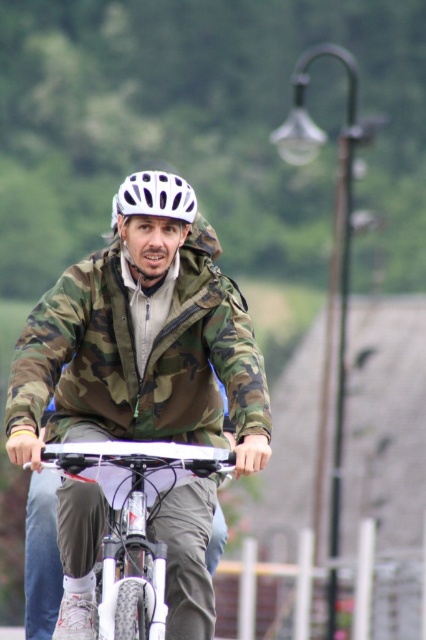
Question: Which object is positioned farthest from the camo fabric jacket at center?

Choices:
 (A) white matte bicycle at center
 (B) white matte helmet at center

Answer: (B)

Question: Observing the image, what is the correct spatial positioning of camo fabric jacket at center in reference to white matte bicycle at center?

Choices:
 (A) below
 (B) above

Answer: (B)

Question: Does camo fabric jacket at center have a smaller size compared to white matte helmet at center?

Choices:
 (A) yes
 (B) no

Answer: (A)

Question: Is camo fabric jacket at center bigger than white matte helmet at center?

Choices:
 (A) yes
 (B) no

Answer: (B)

Question: Considering the real-world distances, which object is closest to the camo fabric jacket at center?

Choices:
 (A) white matte bicycle at center
 (B) white matte helmet at center

Answer: (A)

Question: Which point is farther to the camera?

Choices:
 (A) white matte bicycle at center
 (B) camo fabric jacket at center
 (C) white matte helmet at center

Answer: (C)